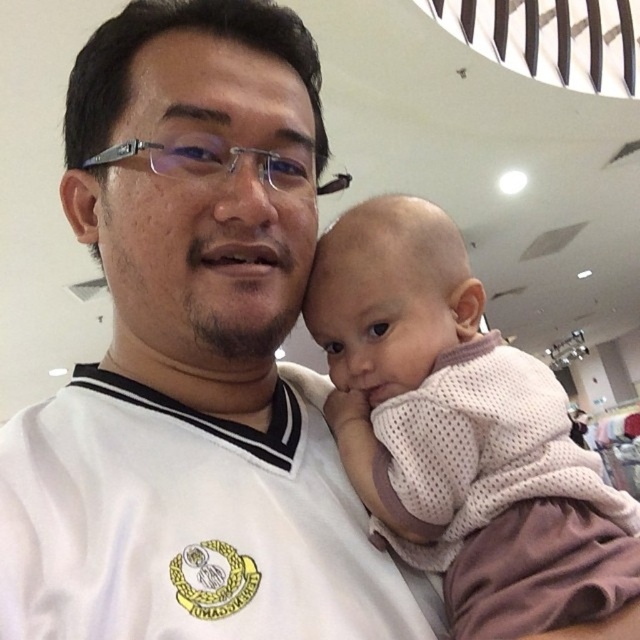
You are a photographer trying to focus on the white mesh shirt at center and the pink mesh shirt at center in the image. Which one is closer to the camera?

The white mesh shirt at center is closer to the camera because it is in front of the pink mesh shirt at center.

You are a photographer trying to decide which shirt to focus on in the image. Both the white mesh shirt at center and the pink mesh shirt at center are in the frame. Which one should you choose if you want to capture the larger one?

The white mesh shirt at center is larger in size than the pink mesh shirt at center, so you should choose the white mesh shirt at center to capture the larger one.

You are a photographer trying to focus on the white mesh shirt at center and the pink mesh shirt at center in the image. Which one is positioned higher in the frame?

The white mesh shirt at center is above the pink mesh shirt at center, so it is positioned higher in the frame.